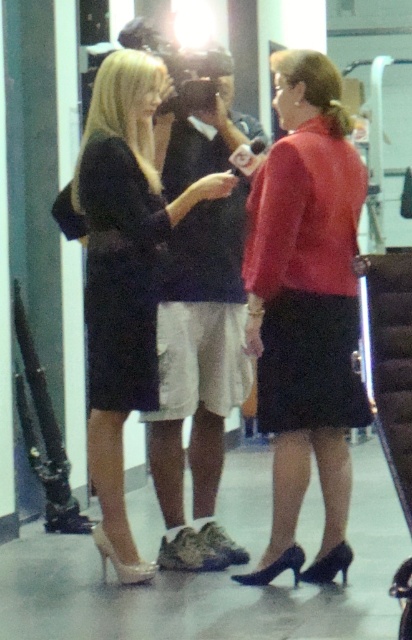
Question: Where is matte red blouse at center located in relation to matte black dress at center in the image?

Choices:
 (A) left
 (B) right

Answer: (B)

Question: Is matte red blouse at center wider than matte black dress at center?

Choices:
 (A) no
 (B) yes

Answer: (A)

Question: Which object appears farthest from the camera in this image?

Choices:
 (A) matte black dress at center
 (B) matte red blouse at center

Answer: (A)

Question: Does matte red blouse at center have a greater width compared to matte black dress at center?

Choices:
 (A) no
 (B) yes

Answer: (A)

Question: Among these objects, which one is farthest from the camera?

Choices:
 (A) matte black dress at center
 (B) matte red blouse at center

Answer: (A)